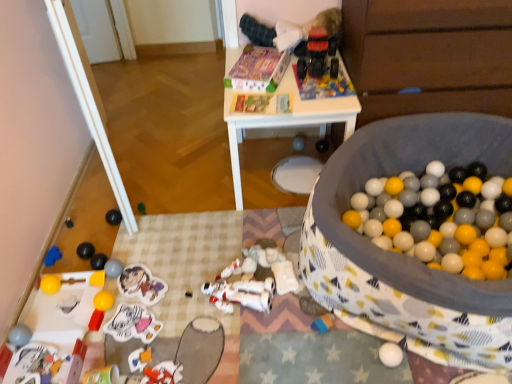
Find the location of a particular element. The width and height of the screenshot is (512, 384). vacant space behind yellow rubber ball at lower left, positioned as the 9th toy in left-to-right order is located at coordinates (124, 273).